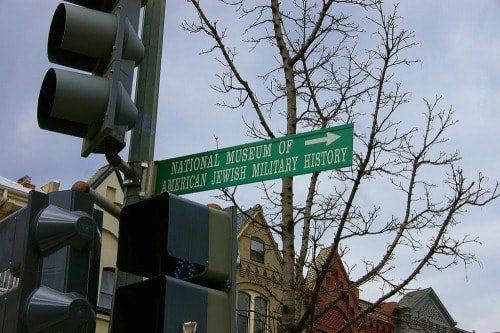
Where is `light housing`? light housing is located at coordinates (72, 317), (122, 103), (227, 239).